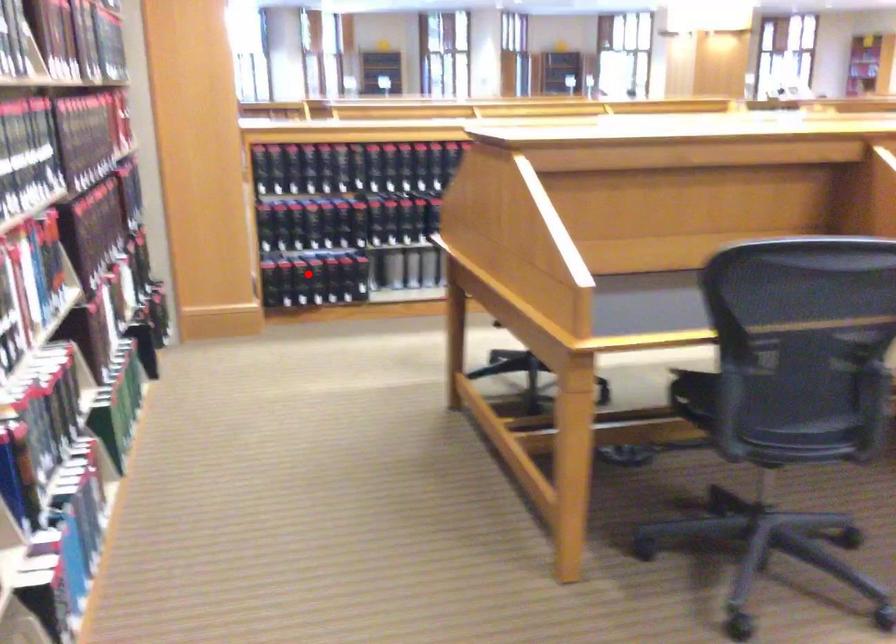
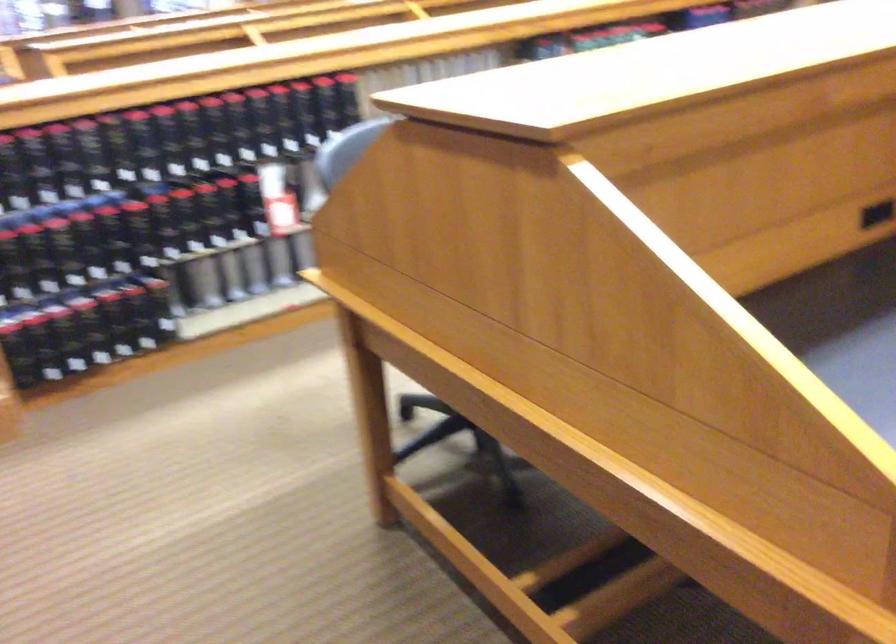
In the second image, find the point that corresponds to the highlighted location in the first image.

(87, 328)